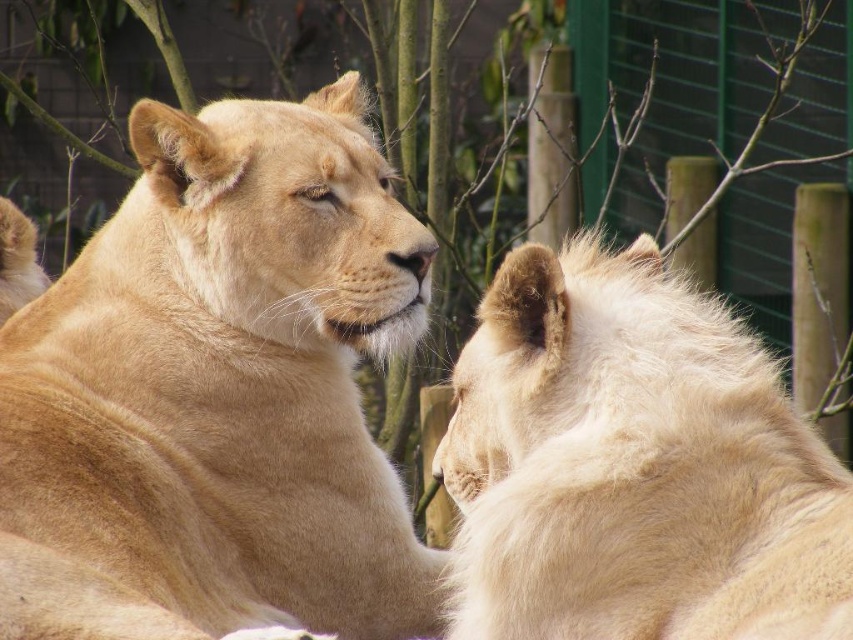
Question: Does golden fur lion at center have a greater width compared to fuzzy white lion at right?

Choices:
 (A) no
 (B) yes

Answer: (B)

Question: Which point is closer to the camera taking this photo?

Choices:
 (A) (73, 561)
 (B) (753, 566)

Answer: (B)

Question: Does golden fur lion at center appear on the left side of fuzzy white lion at right?

Choices:
 (A) yes
 (B) no

Answer: (A)

Question: Among these objects, which one is farthest from the camera?

Choices:
 (A) fuzzy white lion at right
 (B) golden fur lion at center

Answer: (B)

Question: From the image, what is the correct spatial relationship of golden fur lion at center in relation to fuzzy white lion at right?

Choices:
 (A) right
 (B) left

Answer: (B)